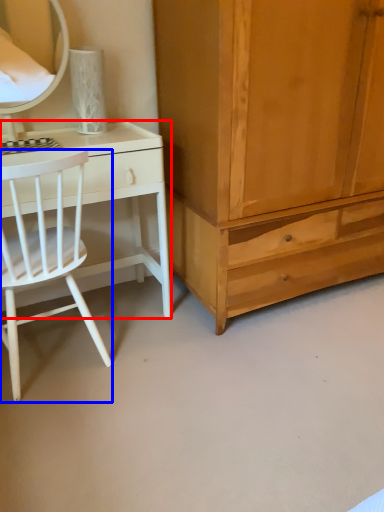
Question: Among these objects, which one is farthest to the camera, desk (highlighted by a red box) or chair (highlighted by a blue box)?

Choices:
 (A) desk
 (B) chair

Answer: (A)